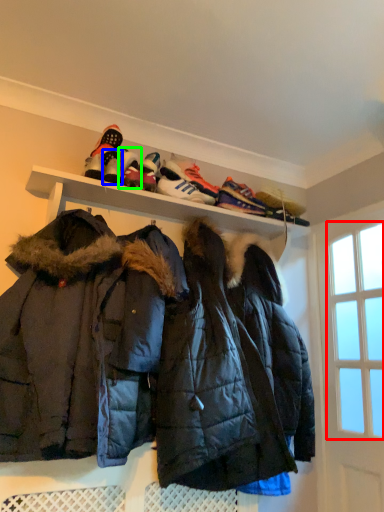
Question: Considering the real-world distances, which object is farthest from window screen (highlighted by a red box)? footwear (highlighted by a blue box) or footwear (highlighted by a green box)?

Choices:
 (A) footwear
 (B) footwear

Answer: (A)